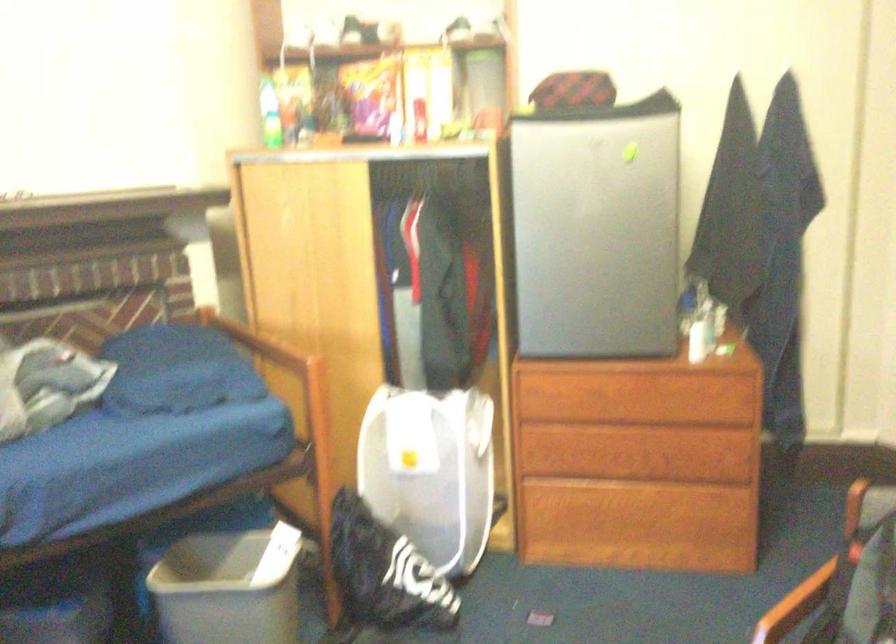
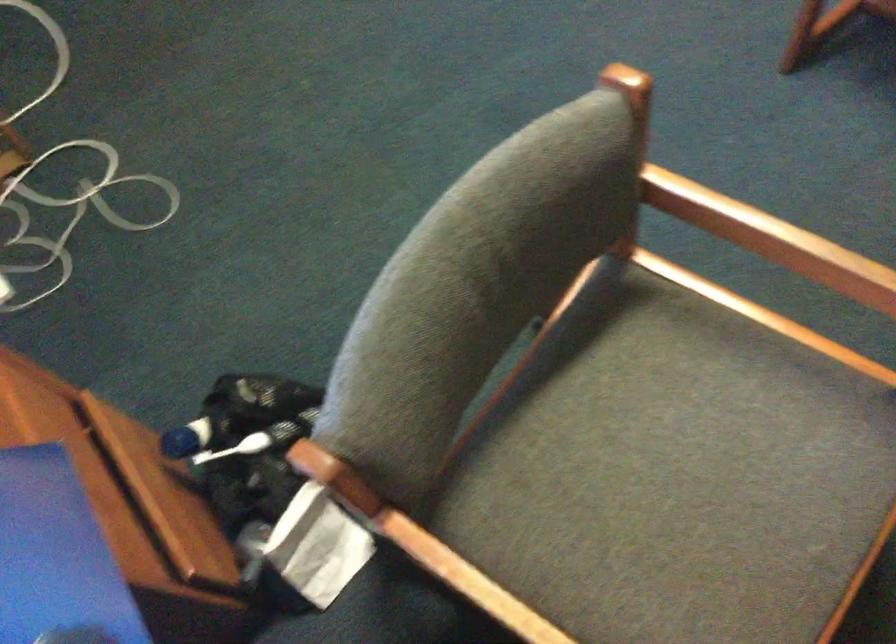
Question: The images are taken continuously from a first-person perspective. In which direction is your viewpoint rotating?

Choices:
 (A) Left
 (B) Right
 (C) Up
 (D) Down

Answer: (D)